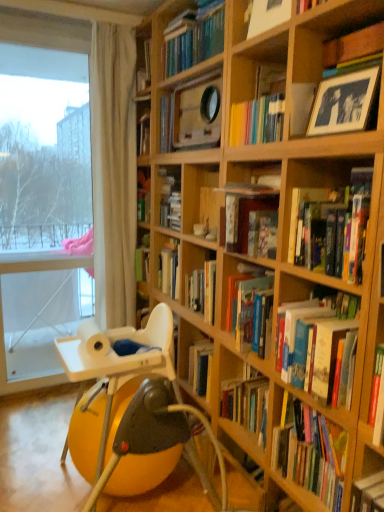
Locate an element on the screen. blue-toned matte photo frame at upper right is located at coordinates (344, 103).

The image size is (384, 512). Describe the element at coordinates (42, 190) in the screenshot. I see `transparent glass window at left` at that location.

Find the location of a particular element. The width and height of the screenshot is (384, 512). hardcover book at upper center, which is the first book in top-to-bottom order is located at coordinates (194, 37).

Find the location of a particular element. hardcover books at center, arranged as the 1th book when ordered from the bottom is located at coordinates (311, 454).

Where is `wooden framed picture at upper right`? wooden framed picture at upper right is located at coordinates (329, 50).

Between hardcover book at center, acting as the 4th book starting from the top, and white sheer curtain at left, which one has larger size?

Bigger between the two is white sheer curtain at left.

Looking at this image, is hardcover book at center, acting as the 4th book starting from the top, behind white sheer curtain at left?

No.

Which object is positioned more to the right, hardcover book at center, the third book positioned from the bottom, or white sheer curtain at left?

Positioned to the right is hardcover book at center, the third book positioned from the bottom.

In terms of height, does hardcover book at center, acting as the 4th book starting from the top, look taller or shorter compared to white sheer curtain at left?

Considering their sizes, hardcover book at center, acting as the 4th book starting from the top, has less height than white sheer curtain at left.

This screenshot has height=512, width=384. Find the location of `window frame below the blue-toned matte photo frame at upper right (from a real-world perspective)`. window frame below the blue-toned matte photo frame at upper right (from a real-world perspective) is located at coordinates (42, 190).

Does blue-toned matte photo frame at upper right have a lesser width compared to transparent glass window at left?

Yes.

Is blue-toned matte photo frame at upper right in contact with transparent glass window at left?

No, blue-toned matte photo frame at upper right is not with transparent glass window at left.

Is wooden framed picture at upper right completely or partially outside of wooden frame at upper center, the second book positioned from the top?

wooden framed picture at upper right lies outside wooden frame at upper center, the second book positioned from the top,'s area.

At what (x,y) coordinates should I click in order to perform the action: click on shelf in front of the wooden frame at upper center, the second book positioned from the top. Please return your answer as a coordinate pair (x, y). Looking at the image, I should click on (329, 50).

From a real-world perspective, is wooden framed picture at upper right located beneath wooden frame at upper center, marked as the 5th book in a bottom-to-top arrangement?

Yes, from a real-world perspective, wooden framed picture at upper right is below wooden frame at upper center, marked as the 5th book in a bottom-to-top arrangement.

Would you say hardcover book at center, arranged as the 5th book when viewed from the top, is to the left or to the right of blue-toned matte photo frame at upper right in the picture?

In the image, hardcover book at center, arranged as the 5th book when viewed from the top, appears on the right side of blue-toned matte photo frame at upper right.

Based on the photo, is hardcover book at center, arranged as the 5th book when viewed from the top, taller than blue-toned matte photo frame at upper right?

Yes, hardcover book at center, arranged as the 5th book when viewed from the top, is taller than blue-toned matte photo frame at upper right.

Considering the relative sizes of hardcover book at center, arranged as the 5th book when viewed from the top, and blue-toned matte photo frame at upper right in the image provided, is hardcover book at center, arranged as the 5th book when viewed from the top, wider than blue-toned matte photo frame at upper right?

Yes.

Are hardcover book at center, arranged as the 5th book when viewed from the top, and blue-toned matte photo frame at upper right beside each other?

No.

From the image's perspective, which one is positioned higher, hardcover book at center, acting as the 4th book starting from the top, or transparent glass window at left?

transparent glass window at left is shown above in the image.

Is the position of hardcover book at center, acting as the 4th book starting from the top, more distant than that of transparent glass window at left?

That is False.

Is hardcover book at center, acting as the 4th book starting from the top, positioned far away from transparent glass window at left?

Indeed, hardcover book at center, acting as the 4th book starting from the top, is not near transparent glass window at left.

Considering the positions of points (336, 456) and (344, 41), is point (336, 456) farther from camera compared to point (344, 41)?

No, it is not.

Is hardcover books at center, the 6th book viewed from the top, aimed at wooden framed picture at upper right?

No, hardcover books at center, the 6th book viewed from the top, is not aimed at wooden framed picture at upper right.

Considering the sizes of hardcover books at center, arranged as the 1th book when ordered from the bottom, and wooden framed picture at upper right in the image, is hardcover books at center, arranged as the 1th book when ordered from the bottom, wider or thinner than wooden framed picture at upper right?

Clearly, hardcover books at center, arranged as the 1th book when ordered from the bottom, has more width compared to wooden framed picture at upper right.

In terms of size, does wooden frame at upper center, the second book positioned from the top, appear bigger or smaller than hardcover book at center, acting as the 4th book starting from the top?

Considering their sizes, wooden frame at upper center, the second book positioned from the top, takes up less space than hardcover book at center, acting as the 4th book starting from the top.

Consider the image. From the image's perspective, between wooden frame at upper center, the second book positioned from the top, and hardcover book at center, acting as the 4th book starting from the top, which one is located above?

From the image's view, wooden frame at upper center, the second book positioned from the top, is above.

The width and height of the screenshot is (384, 512). Find the location of `the 1st book in front of the white sheer curtain at left`. the 1st book in front of the white sheer curtain at left is located at coordinates (189, 283).

Identify the location of window frame directly beneath the blue-toned matte photo frame at upper right (from a real-world perspective). This screenshot has height=512, width=384. (42, 190).

From the image, which object appears to be nearer to white plastic chair at lower left, transparent glass window at left or hardcover books at center, arranged as the 1th book when ordered from the bottom?

Based on the image, hardcover books at center, arranged as the 1th book when ordered from the bottom, appears to be nearer to white plastic chair at lower left.

Considering their positions, is wooden frame at upper center, marked as the 5th book in a bottom-to-top arrangement, positioned further to wooden framed picture at upper right than blue-toned matte photo frame at upper right?

Among the two, wooden frame at upper center, marked as the 5th book in a bottom-to-top arrangement, is located further to wooden framed picture at upper right.

Estimate the real-world distances between objects in this image. Which object is closer to hardcover book at upper center, which is the 6th book from bottom to top, blue-toned matte photo frame at upper right or transparent glass window at left?

blue-toned matte photo frame at upper right is positioned closer to the anchor hardcover book at upper center, which is the 6th book from bottom to top.

Based on their spatial positions, is hardcover book at center, arranged as the 5th book when viewed from the top, or hardcover book at center, acting as the 4th book starting from the top, closer to wooden framed picture at upper right?

hardcover book at center, arranged as the 5th book when viewed from the top, is closer to wooden framed picture at upper right.

Looking at the image, which one is located further to hardcover book at center, which ranks as the second book in bottom-to-top order, hardcover book at center, acting as the 4th book starting from the top, or wooden frame at upper center, the second book positioned from the top?

wooden frame at upper center, the second book positioned from the top, is further to hardcover book at center, which ranks as the second book in bottom-to-top order.

Estimate the real-world distances between objects in this image. Which object is further from wooden framed picture at upper right, white sheer curtain at left or hardcover book at upper right, which is counted as the 3th book, starting from the top?

Based on the image, white sheer curtain at left appears to be further to wooden framed picture at upper right.

Estimate the real-world distances between objects in this image. Which object is closer to white plastic chair at lower left, hardcover book at center, which ranks as the second book in bottom-to-top order, or wooden frame at upper center, the second book positioned from the top?

hardcover book at center, which ranks as the second book in bottom-to-top order.

When comparing their distances from white sheer curtain at left, does blue-toned matte photo frame at upper right or wooden framed picture at upper right seem further?

blue-toned matte photo frame at upper right lies further to white sheer curtain at left than the other object.

Where is `curtain between hardcover book at upper center, which is the 6th book from bottom to top, and white plastic chair at lower left, in the vertical direction`? The width and height of the screenshot is (384, 512). curtain between hardcover book at upper center, which is the 6th book from bottom to top, and white plastic chair at lower left, in the vertical direction is located at coordinates (113, 172).

Locate an element on the screen. The height and width of the screenshot is (512, 384). paperback book between transparent glass window at left and wooden framed picture at upper right from left to right is located at coordinates (344, 103).

This screenshot has height=512, width=384. I want to click on chair between transparent glass window at left and hardcover book at upper right, which is counted as the 3th book, starting from the top, from left to right, so click(x=134, y=394).

Identify the location of paperback book between wooden frame at upper center, marked as the 5th book in a bottom-to-top arrangement, and white plastic chair at lower left vertically. The height and width of the screenshot is (512, 384). (344, 103).